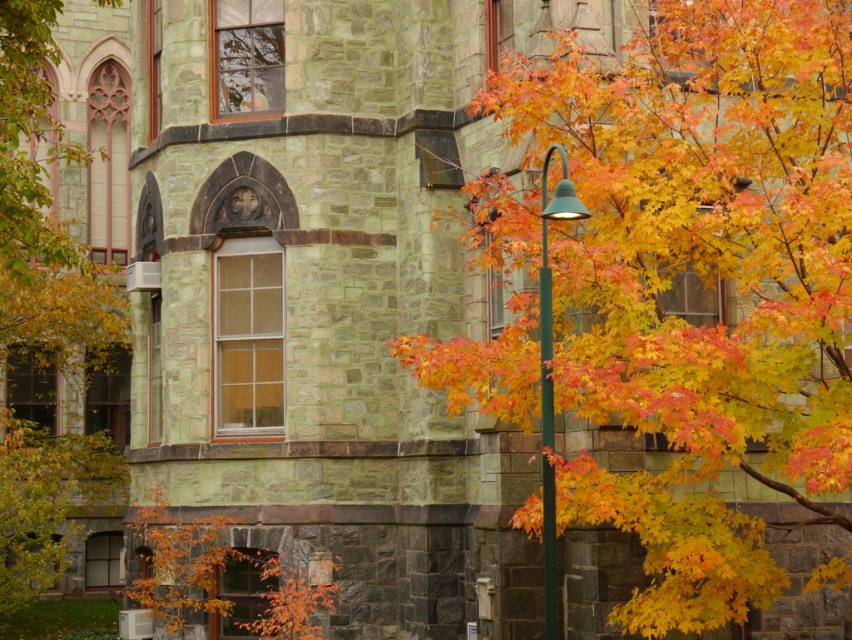
In the scene shown: Between autumn leaves at right and autumn leaves at left, which one has less height?

With less height is autumn leaves at right.

Is autumn leaves at right further to the viewer compared to autumn leaves at left?

No, it is not.

Identify the location of autumn leaves at right. This screenshot has width=852, height=640. (701, 278).

Is autumn leaves at left below green metallic pole at center?

No, autumn leaves at left is not below green metallic pole at center.

Who is higher up, autumn leaves at left or green metallic pole at center?

autumn leaves at left

The width and height of the screenshot is (852, 640). What do you see at coordinates (41, 211) in the screenshot? I see `autumn leaves at left` at bounding box center [41, 211].

You are a GUI agent. You are given a task and a screenshot of the screen. Output one action in this format:
    pyautogui.click(x=<x>, y=<y>)
    Task: Click on the autumn leaves at left
    
    Given the screenshot: What is the action you would take?
    pyautogui.click(x=41, y=211)

Between autumn leaves at right and green metallic pole at center, which one appears on the right side from the viewer's perspective?

Positioned to the right is autumn leaves at right.

Can you confirm if autumn leaves at right is positioned to the right of green metallic pole at center?

Yes, autumn leaves at right is to the right of green metallic pole at center.

Does point (649, 348) come behind point (550, 474)?

That is False.

Identify the location of autumn leaves at right. The height and width of the screenshot is (640, 852). (701, 278).